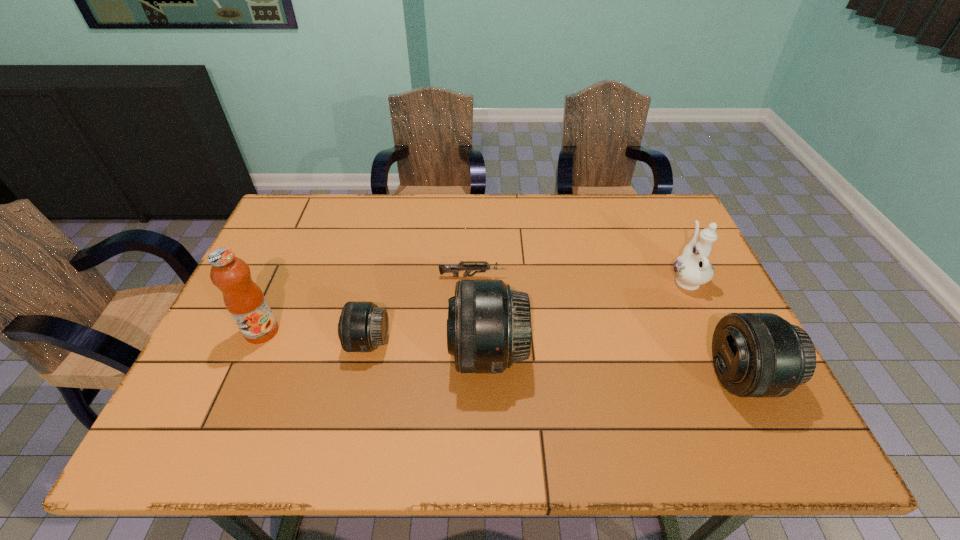
Please point a spot to place another telephoto_lens for symmetrical spacing. Please provide its 2D coordinates. Your answer should be formatted as a tuple, i.e. [(x, y)], where the tuple contains the x and y coordinates of a point satisfying the conditions above.

[(612, 365)]